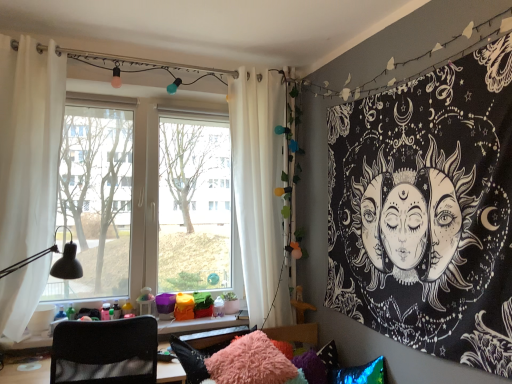
The width and height of the screenshot is (512, 384). What do you see at coordinates (29, 146) in the screenshot? I see `white sheer curtain at left, which is the second curtain from back to front` at bounding box center [29, 146].

The height and width of the screenshot is (384, 512). Identify the location of black paper tapestry at upper right. (428, 211).

I want to click on black mesh chair at lower left, so (105, 352).

The width and height of the screenshot is (512, 384). Find the location of `transparent glass window at center`. transparent glass window at center is located at coordinates (147, 200).

Considering the relative sizes of black mesh chair at lower left and black paper tapestry at upper right in the image provided, is black mesh chair at lower left wider than black paper tapestry at upper right?

Indeed, black mesh chair at lower left has a greater width compared to black paper tapestry at upper right.

From the image's perspective, which one is positioned lower, black mesh chair at lower left or black paper tapestry at upper right?

black mesh chair at lower left appears lower in the image.

Between black mesh chair at lower left and black paper tapestry at upper right, which one is positioned in front?

black paper tapestry at upper right is more forward.

Is black mesh chair at lower left touching black paper tapestry at upper right?

No, black mesh chair at lower left is not making contact with black paper tapestry at upper right.

Is black paper tapestry at upper right located within black matte table lamp at lower left?

No, black paper tapestry at upper right is located outside of black matte table lamp at lower left.

Looking at their sizes, would you say black matte table lamp at lower left is wider or thinner than black paper tapestry at upper right?

In the image, black matte table lamp at lower left appears to be wider than black paper tapestry at upper right.

The image size is (512, 384). I want to click on bulletin board on the right of black matte table lamp at lower left, so click(x=428, y=211).

From the image's perspective, who appears lower, black matte table lamp at lower left or black paper tapestry at upper right?

From the image's view, black matte table lamp at lower left is below.

Considering the positions of point (13, 218) and point (238, 367), is point (13, 218) closer or farther from the camera than point (238, 367)?

Point (13, 218).

Between white sheer curtain at left, which is counted as the second curtain, starting from the right, and fuzzy pink pillow at lower center, which one has less height?

Standing shorter between the two is fuzzy pink pillow at lower center.

Is white sheer curtain at left, which is counted as the second curtain, starting from the right, positioned before fuzzy pink pillow at lower center?

No.

In terms of size, does white sheer curtain at left, which is the second curtain from back to front, appear bigger or smaller than fuzzy pink pillow at lower center?

In the image, white sheer curtain at left, which is the second curtain from back to front, appears to be larger than fuzzy pink pillow at lower center.

Who is smaller, white sheer curtain at left, which is counted as the first curtain, starting from the left, or white fabric curtain at right, arranged as the 2th curtain when viewed from the left?

white sheer curtain at left, which is counted as the first curtain, starting from the left, is smaller.

Is white sheer curtain at left, which is counted as the second curtain, starting from the right, aimed at white fabric curtain at right, which appears as the second curtain when viewed from the front?

No, white sheer curtain at left, which is counted as the second curtain, starting from the right, is not facing towards white fabric curtain at right, which appears as the second curtain when viewed from the front.

From a real-world perspective, who is located lower, white sheer curtain at left, which is the second curtain from back to front, or white fabric curtain at right, the 1th curtain from the back?

white fabric curtain at right, the 1th curtain from the back, from a real-world perspective.

What are the coordinates of `curtain behind the white sheer curtain at left, which is counted as the second curtain, starting from the right` in the screenshot? It's located at (259, 192).

From a real-world perspective, is black matte table lamp at lower left on fuzzy pink pillow at lower center?

Correct, in the physical world, black matte table lamp at lower left is higher than fuzzy pink pillow at lower center.

How different are the orientations of black matte table lamp at lower left and fuzzy pink pillow at lower center in degrees?

The angular difference between black matte table lamp at lower left and fuzzy pink pillow at lower center is 88.2 degrees.

Can you confirm if black matte table lamp at lower left is thinner than fuzzy pink pillow at lower center?

No, black matte table lamp at lower left is not thinner than fuzzy pink pillow at lower center.

Considering the relative positions of transparent glass window at center and black mesh chair at lower left in the image provided, is transparent glass window at center to the right of black mesh chair at lower left from the viewer's perspective?

Correct, you'll find transparent glass window at center to the right of black mesh chair at lower left.

Does point (184, 156) appear closer or farther from the camera than point (65, 337)?

Point (184, 156).

Is transparent glass window at center positioned with its back to black mesh chair at lower left?

transparent glass window at center is not turned away from black mesh chair at lower left.

Considering the relative sizes of transparent glass window at center and black mesh chair at lower left in the image provided, is transparent glass window at center thinner than black mesh chair at lower left?

Yes.

Who is smaller, black paper tapestry at upper right or white fabric curtain at right, the 1th curtain viewed from the right?

black paper tapestry at upper right.

From the image's perspective, who appears lower, black paper tapestry at upper right or white fabric curtain at right, the 1th curtain viewed from the right?

black paper tapestry at upper right, from the image's perspective.

Could you measure the distance between black paper tapestry at upper right and white fabric curtain at right, the 1th curtain viewed from the right?

black paper tapestry at upper right is 35.14 inches away from white fabric curtain at right, the 1th curtain viewed from the right.

Does point (507, 251) lie behind point (239, 141)?

No, (507, 251) is closer to viewer.

You are a GUI agent. You are given a task and a screenshot of the screen. Output one action in this format:
    pyautogui.click(x=<x>, y=<y>)
    Task: Click on the chair below the black paper tapestry at upper right (from the image's perspective)
    The height and width of the screenshot is (384, 512).
    Given the screenshot: What is the action you would take?
    pyautogui.click(x=105, y=352)

The image size is (512, 384). In order to click on bulletin board that is above the black matte table lamp at lower left (from a real-world perspective) in this screenshot , I will do coord(428,211).

Consider the image. Which object lies further to the anchor point black paper tapestry at upper right, black matte table lamp at lower left or white fabric curtain at right, the 1th curtain from the back?

black matte table lamp at lower left is further to black paper tapestry at upper right.

When comparing their distances from white sheer curtain at left, which is counted as the second curtain, starting from the right, does black paper tapestry at upper right or black mesh chair at lower left seem further?

A: black paper tapestry at upper right is positioned further to the anchor white sheer curtain at left, which is counted as the second curtain, starting from the right.

Based on their spatial positions, is black matte table lamp at lower left or black paper tapestry at upper right closer to black mesh chair at lower left?

black matte table lamp at lower left is closer to black mesh chair at lower left.

From the image, which object appears to be farther from fuzzy pink pillow at lower center, white sheer curtain at left, the first curtain from the front, or black paper tapestry at upper right?

white sheer curtain at left, the first curtain from the front, is further to fuzzy pink pillow at lower center.

Looking at the image, which one is located closer to transparent glass window at center, black mesh chair at lower left or white fabric curtain at right, the 1th curtain from the back?

white fabric curtain at right, the 1th curtain from the back, is closer to transparent glass window at center.

Estimate the real-world distances between objects in this image. Which object is further from white sheer curtain at left, the first curtain from the front, fuzzy pink pillow at lower center or black paper tapestry at upper right?

black paper tapestry at upper right lies further to white sheer curtain at left, the first curtain from the front, than the other object.

From the image, which object appears to be farther from black matte table lamp at lower left, fuzzy pink pillow at lower center or white sheer curtain at left, which is counted as the first curtain, starting from the left?

fuzzy pink pillow at lower center is positioned further to the anchor black matte table lamp at lower left.

Estimate the real-world distances between objects in this image. Which object is closer to white sheer curtain at left, the first curtain from the front, white fabric curtain at right, arranged as the 2th curtain when viewed from the left, or black matte table lamp at lower left?

The object closer to white sheer curtain at left, the first curtain from the front, is black matte table lamp at lower left.

At what (x,y) coordinates should I click in order to perform the action: click on window between white fabric curtain at right, which appears as the second curtain when viewed from the front, and fuzzy pink pillow at lower center from top to bottom. Please return your answer as a coordinate pair (x, y). Image resolution: width=512 pixels, height=384 pixels. Looking at the image, I should click on (147, 200).

Locate an element on the screen. pillow positioned between black paper tapestry at upper right and white fabric curtain at right, arranged as the 2th curtain when viewed from the left, from near to far is located at coordinates (252, 363).

In order to click on pillow located between black mesh chair at lower left and black paper tapestry at upper right in the left-right direction in this screenshot , I will do `click(252, 363)`.

You are a GUI agent. You are given a task and a screenshot of the screen. Output one action in this format:
    pyautogui.click(x=<x>, y=<y>)
    Task: Click on the window situated between black matte table lamp at lower left and fuzzy pink pillow at lower center from left to right
    
    Given the screenshot: What is the action you would take?
    pyautogui.click(x=147, y=200)